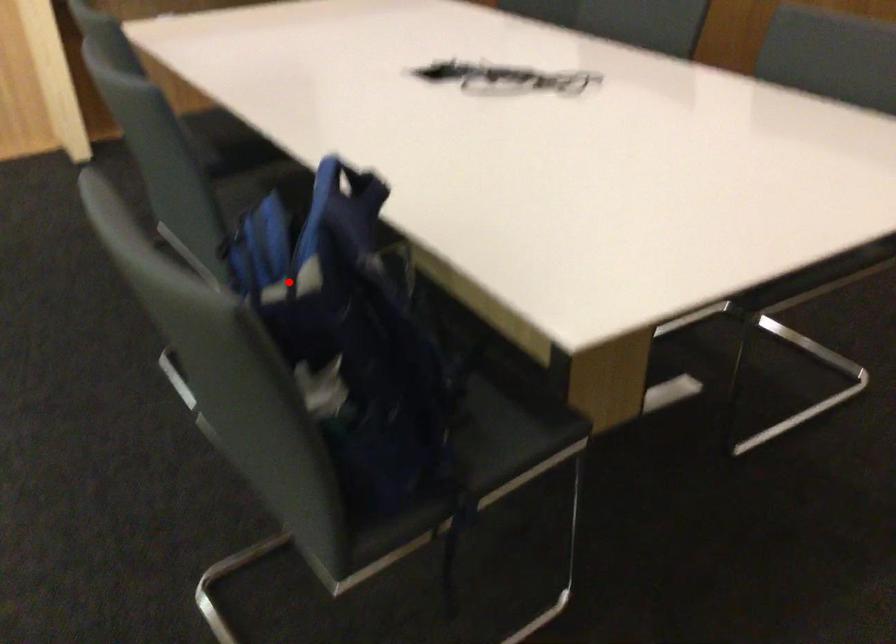
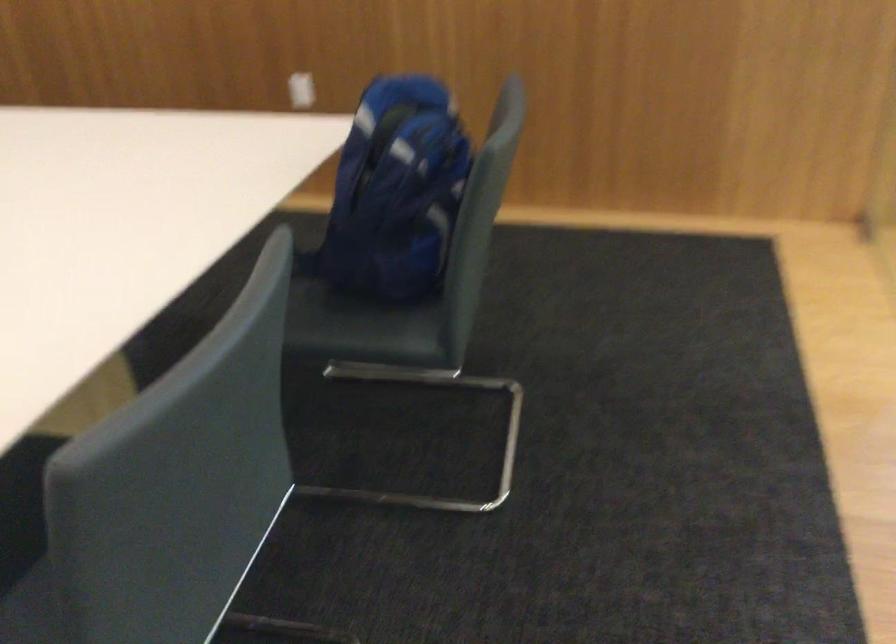
The point at the highlighted location is marked in the first image. Where is the corresponding point in the second image?

(395, 192)